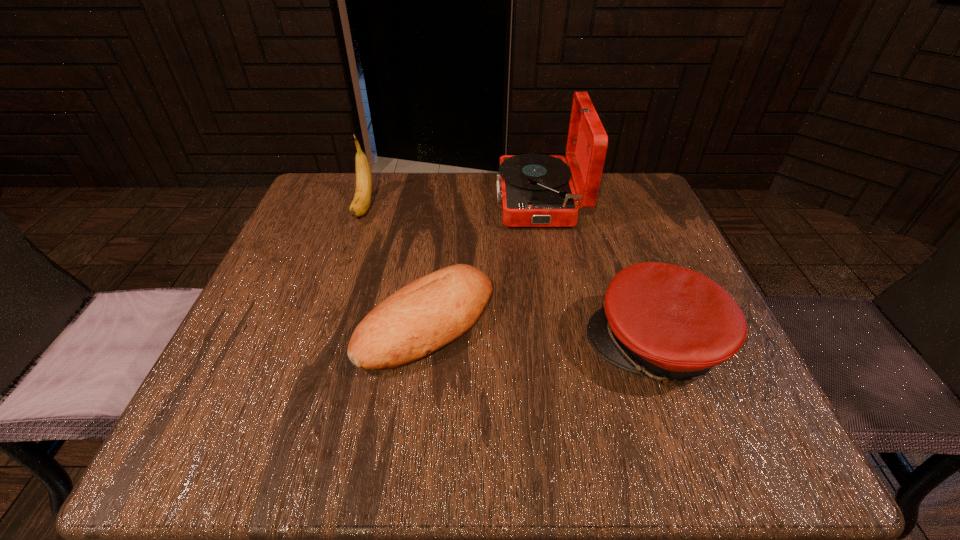
At what (x,y) coordinates should I click in order to perform the action: click on empty location between the third tallest object and the banana. Please return your answer as a coordinate pair (x, y). Image resolution: width=960 pixels, height=540 pixels. Looking at the image, I should click on (510, 276).

Find the location of a particular element. The height and width of the screenshot is (540, 960). blank region between the third tallest object and the third object from right to left is located at coordinates (541, 334).

Identify the location of free space between the cap and the second tallest object. (510, 276).

The height and width of the screenshot is (540, 960). I want to click on free space between the bread and the tallest object, so click(x=483, y=261).

The height and width of the screenshot is (540, 960). Identify the location of object that is the second closest to the second shortest object. (536, 190).

Where is `object identified as the second closest to the second tallest object`? The height and width of the screenshot is (540, 960). object identified as the second closest to the second tallest object is located at coordinates (536, 190).

Find the location of a particular element. This screenshot has width=960, height=540. vacant point that satisfies the following two spatial constraints: 1. at the start of the peel on the shortest object; 2. on the left side of the leftmost object is located at coordinates (324, 323).

Identify the location of blank space that satisfies the following two spatial constraints: 1. on the front-facing side of the tallest object; 2. at the start of the peel on the banana. (540, 207).

You are a GUI agent. You are given a task and a screenshot of the screen. Output one action in this format:
    pyautogui.click(x=<x>, y=<y>)
    Task: Click on the free spot that satisfies the following two spatial constraints: 1. on the front-facing side of the phonograph_record; 2. at the start of the peel on the leftmost object
    This screenshot has height=540, width=960.
    Given the screenshot: What is the action you would take?
    pyautogui.click(x=540, y=207)